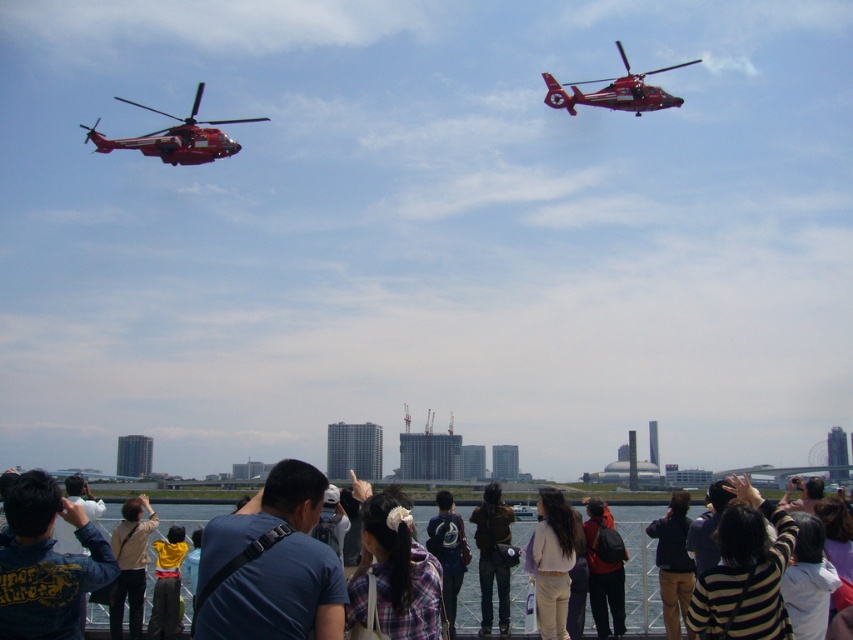
Who is higher up, light brown hair at center or dark blue backpack at center?

dark blue backpack at center is higher up.

Which of these two, light brown hair at center or dark blue backpack at center, stands shorter?

dark blue backpack at center is shorter.

Where is `light brown hair at center`? The height and width of the screenshot is (640, 853). light brown hair at center is located at coordinates (552, 563).

Between light brown hair at center and metallic red helicopter at upper right, which one has less height?

With less height is metallic red helicopter at upper right.

Does light brown hair at center appear under metallic red helicopter at upper right?

Yes, light brown hair at center is below metallic red helicopter at upper right.

Does point (535, 538) come closer to viewer compared to point (558, 104)?

Yes.

The height and width of the screenshot is (640, 853). What are the coordinates of `light brown hair at center` in the screenshot? It's located at (552, 563).

Does light brown leather jacket at lower left have a lesser height compared to yellow fabric at center?

In fact, light brown leather jacket at lower left may be taller than yellow fabric at center.

Is light brown leather jacket at lower left positioned behind yellow fabric at center?

That is False.

Is point (120, 618) positioned in front of point (161, 566)?

That is False.

This screenshot has width=853, height=640. I want to click on light brown leather jacket at lower left, so click(131, 564).